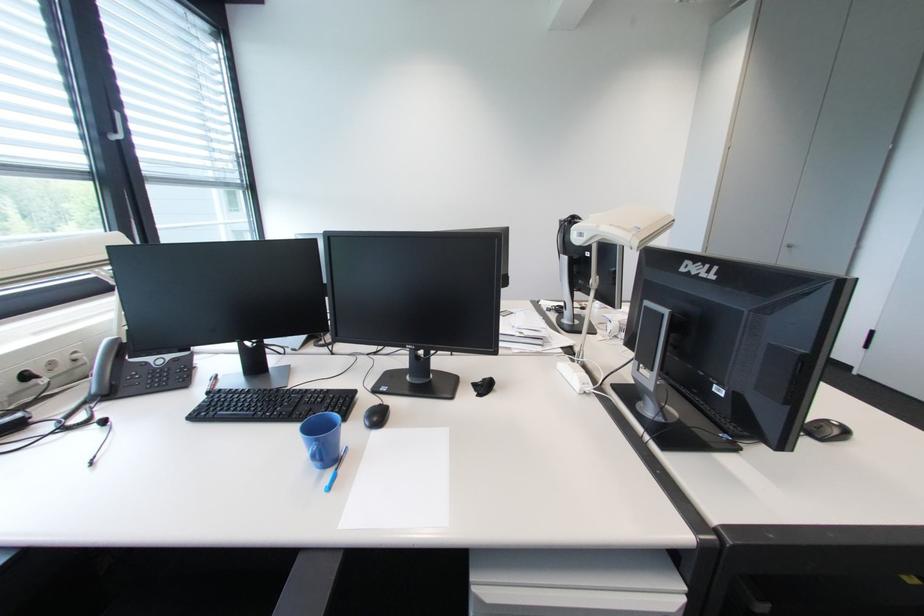
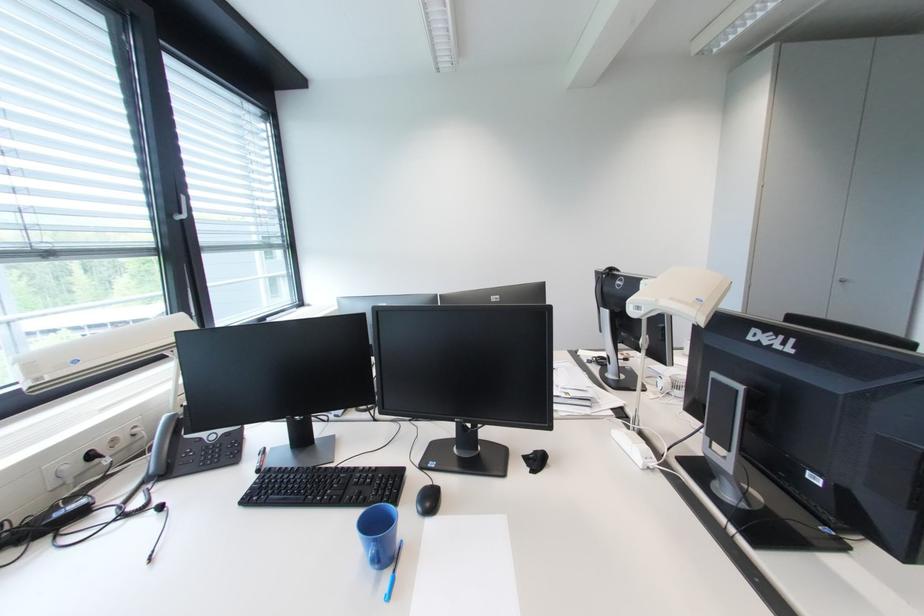
The point at [32,379] is marked in the first image. Where is the corresponding point in the second image?

(98, 458)